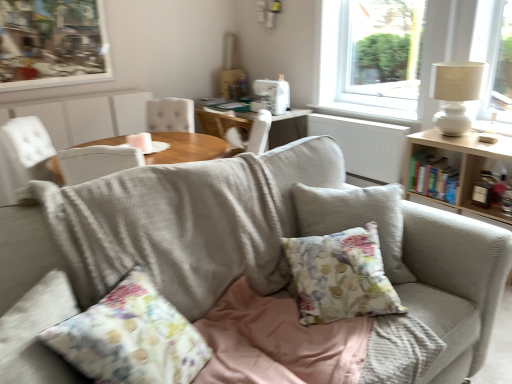
Question: Does white glass window at upper right come in front of wooden picture frame at upper left?

Choices:
 (A) yes
 (B) no

Answer: (A)

Question: Does white glass window at upper right have a greater height compared to wooden picture frame at upper left?

Choices:
 (A) no
 (B) yes

Answer: (B)

Question: From a real-world perspective, is white glass window at upper right beneath wooden picture frame at upper left?

Choices:
 (A) no
 (B) yes

Answer: (B)

Question: Is white glass window at upper right to the left of wooden picture frame at upper left from the viewer's perspective?

Choices:
 (A) no
 (B) yes

Answer: (A)

Question: Is white glass window at upper right turned away from wooden picture frame at upper left?

Choices:
 (A) no
 (B) yes

Answer: (A)

Question: Would you say wooden picture frame at upper left is part of white glass window at upper right's contents?

Choices:
 (A) yes
 (B) no

Answer: (B)

Question: Would you say white fabric chair at center is a long distance from white glass window at upper right?

Choices:
 (A) yes
 (B) no

Answer: (A)

Question: Is white fabric chair at center in contact with white glass window at upper right?

Choices:
 (A) yes
 (B) no

Answer: (B)

Question: From a real-world perspective, is white fabric chair at center positioned over white glass window at upper right based on gravity?

Choices:
 (A) no
 (B) yes

Answer: (A)

Question: Can you confirm if white fabric chair at center is thinner than white glass window at upper right?

Choices:
 (A) yes
 (B) no

Answer: (A)

Question: Can you confirm if white fabric chair at center is bigger than white glass window at upper right?

Choices:
 (A) no
 (B) yes

Answer: (A)

Question: Does white fabric chair at center have a greater height compared to white glass window at upper right?

Choices:
 (A) no
 (B) yes

Answer: (A)

Question: Can you confirm if white fabric chair at center is positioned to the right of white ceramic table lamp at upper right?

Choices:
 (A) no
 (B) yes

Answer: (A)